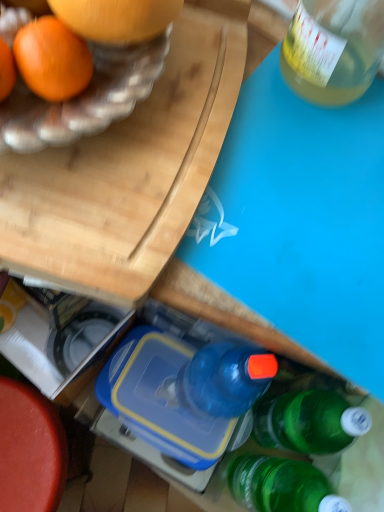
You are a GUI agent. You are given a task and a screenshot of the screen. Output one action in this format:
    pyautogui.click(x=<x>, y=<y>)
    Task: Click on the free space to the right of wooden cutting board at upper left
    Image resolution: width=384 pixels, height=512 pixels.
    Given the screenshot: What is the action you would take?
    pyautogui.click(x=236, y=179)